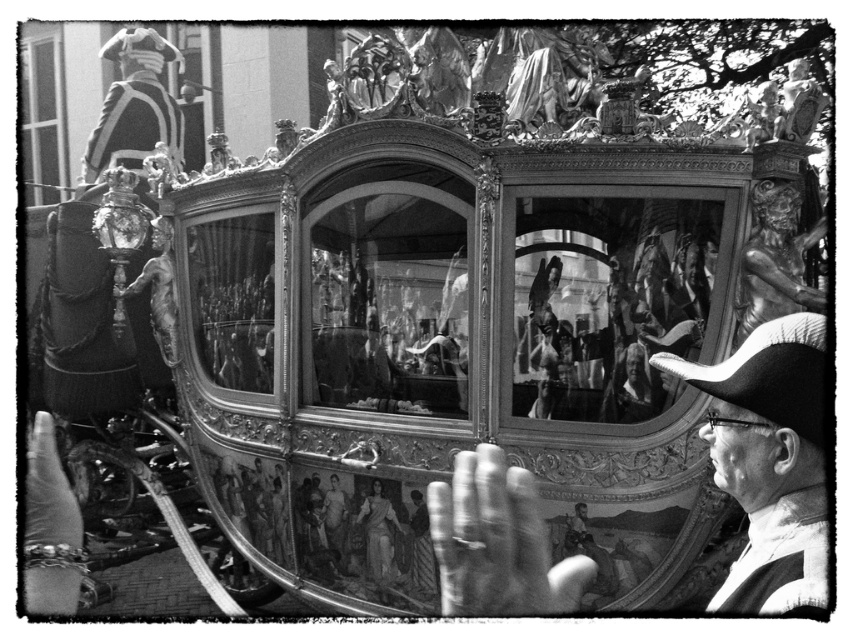
Between smooth leather hat at center and smooth black hat at right, which one appears on the right side from the viewer's perspective?

From the viewer's perspective, smooth black hat at right appears more on the right side.

The width and height of the screenshot is (853, 640). Find the location of `smooth leather hat at center`. smooth leather hat at center is located at coordinates (769, 460).

Can you confirm if smooth black hat at right is positioned above smooth white statue at center?

Yes.

Is point (769, 580) positioned before point (393, 552)?

Yes, it is.

Is point (735, 460) farther from camera compared to point (369, 497)?

No, it is not.

At what (x,y) coordinates should I click in order to perform the action: click on smooth black hat at right. Please return your answer as a coordinate pair (x, y). This screenshot has height=640, width=853. Looking at the image, I should click on (769, 460).

Does smooth leather hat at center have a larger size compared to smooth white statue at center?

Indeed, smooth leather hat at center has a larger size compared to smooth white statue at center.

From the picture: Who is more distant from viewer, (x=500, y=460) or (x=387, y=518)?

The point (x=387, y=518) is behind.

The image size is (853, 640). What are the coordinates of `smooth leather hat at center` in the screenshot? It's located at (769, 460).